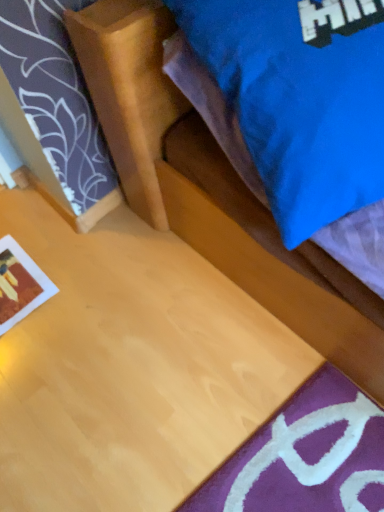
Question: From the image's perspective, relative to matte blue pillow at upper right, is matte paper print at lower left above or below?

Choices:
 (A) below
 (B) above

Answer: (A)

Question: Considering the relative positions of matte paper print at lower left and matte blue pillow at upper right in the image provided, is matte paper print at lower left to the left or to the right of matte blue pillow at upper right?

Choices:
 (A) right
 (B) left

Answer: (B)

Question: Relative to matte blue pillow at upper right, is matte paper print at lower left in front or behind?

Choices:
 (A) behind
 (B) front

Answer: (A)

Question: Is matte blue pillow at upper right in front of or behind matte paper print at lower left in the image?

Choices:
 (A) behind
 (B) front

Answer: (B)

Question: From the image's perspective, is matte blue pillow at upper right located above or below matte paper print at lower left?

Choices:
 (A) below
 (B) above

Answer: (B)

Question: Considering the positions of matte blue pillow at upper right and matte paper print at lower left in the image, is matte blue pillow at upper right bigger or smaller than matte paper print at lower left?

Choices:
 (A) small
 (B) big

Answer: (B)

Question: From a real-world perspective, is matte blue pillow at upper right above or below matte paper print at lower left?

Choices:
 (A) above
 (B) below

Answer: (A)